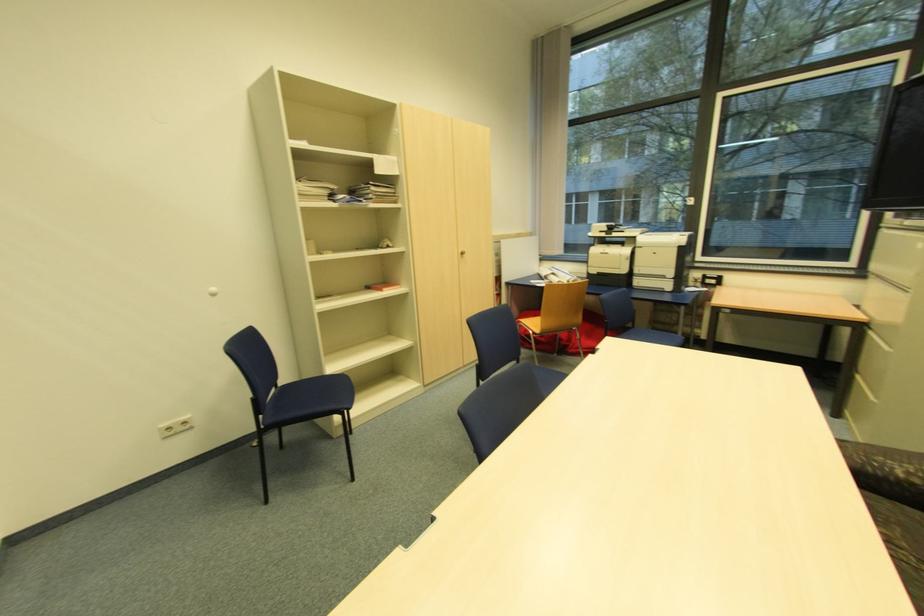
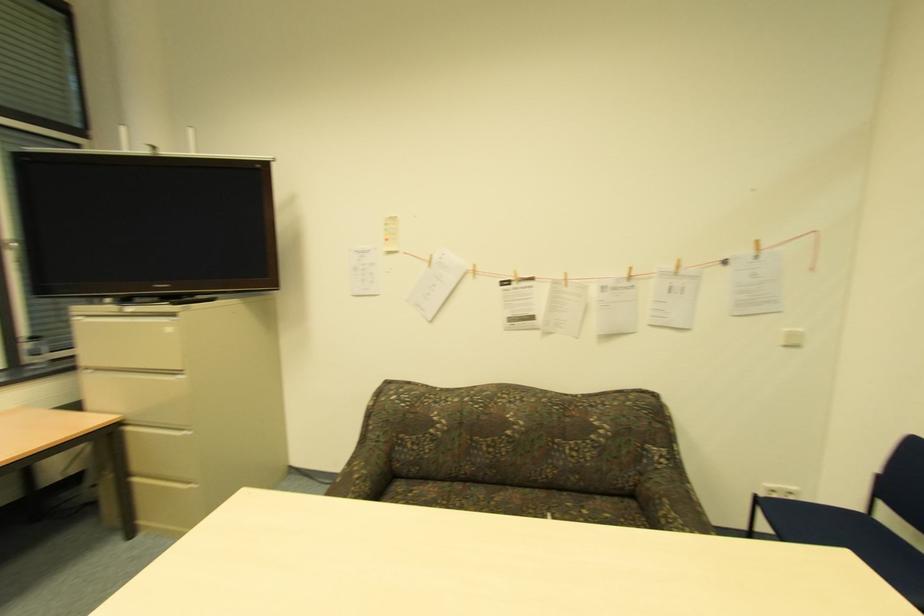
The point at (894, 347) is marked in the first image. Where is the corresponding point in the second image?

(187, 429)